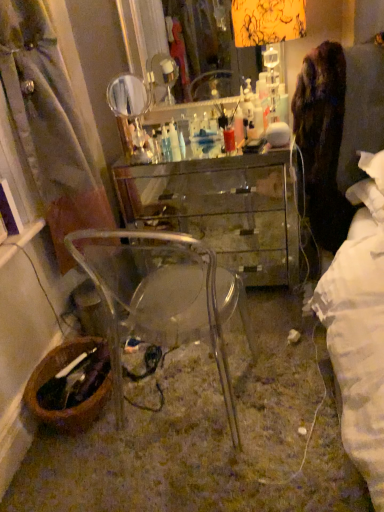
Question: Can you confirm if transparent plastic chair at lower center is smaller than transparent glass desk at center?

Choices:
 (A) yes
 (B) no

Answer: (A)

Question: Is transparent plastic chair at lower center shorter than transparent glass desk at center?

Choices:
 (A) no
 (B) yes

Answer: (A)

Question: Does transparent plastic chair at lower center lie behind transparent glass desk at center?

Choices:
 (A) yes
 (B) no

Answer: (B)

Question: From a real-world perspective, is transparent plastic chair at lower center on top of transparent glass desk at center?

Choices:
 (A) no
 (B) yes

Answer: (B)

Question: Is transparent plastic chair at lower center bigger than transparent glass desk at center?

Choices:
 (A) no
 (B) yes

Answer: (A)

Question: Is point (192, 266) positioned closer to the camera than point (26, 387)?

Choices:
 (A) closer
 (B) farther

Answer: (B)

Question: Which is correct: transparent plastic chair at lower center is inside brown woven picnic basket at lower left, or outside of it?

Choices:
 (A) inside
 (B) outside

Answer: (B)

Question: From their relative heights in the image, would you say transparent plastic chair at lower center is taller or shorter than brown woven picnic basket at lower left?

Choices:
 (A) tall
 (B) short

Answer: (A)

Question: Considering the relative positions of transparent plastic chair at lower center and brown woven picnic basket at lower left in the image provided, is transparent plastic chair at lower center to the left or to the right of brown woven picnic basket at lower left?

Choices:
 (A) left
 (B) right

Answer: (B)

Question: Is brown woven picnic basket at lower left in front of or behind clear glass mirror at upper center in the image?

Choices:
 (A) behind
 (B) front

Answer: (B)

Question: From a real-world perspective, is brown woven picnic basket at lower left positioned above or below clear glass mirror at upper center?

Choices:
 (A) above
 (B) below

Answer: (B)

Question: From the image's perspective, is brown woven picnic basket at lower left positioned above or below clear glass mirror at upper center?

Choices:
 (A) below
 (B) above

Answer: (A)

Question: Considering the positions of brown woven picnic basket at lower left and clear glass mirror at upper center in the image, is brown woven picnic basket at lower left taller or shorter than clear glass mirror at upper center?

Choices:
 (A) short
 (B) tall

Answer: (A)

Question: From a real-world perspective, relative to brown woven picnic basket at lower left, is transparent glass desk at center vertically above or below?

Choices:
 (A) below
 (B) above

Answer: (B)

Question: In the image, is transparent glass desk at center positioned in front of or behind brown woven picnic basket at lower left?

Choices:
 (A) front
 (B) behind

Answer: (B)